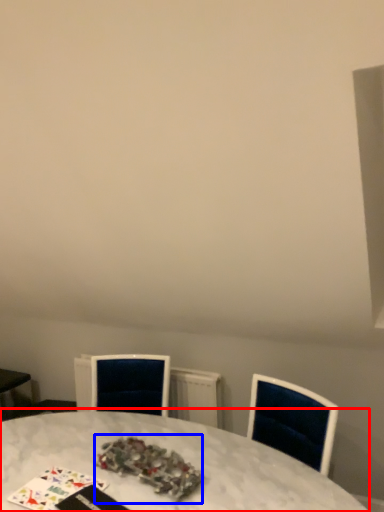
Question: Among these objects, which one is farthest to the camera, table (highlighted by a red box) or christmas decoration (highlighted by a blue box)?

Choices:
 (A) table
 (B) christmas decoration

Answer: (B)